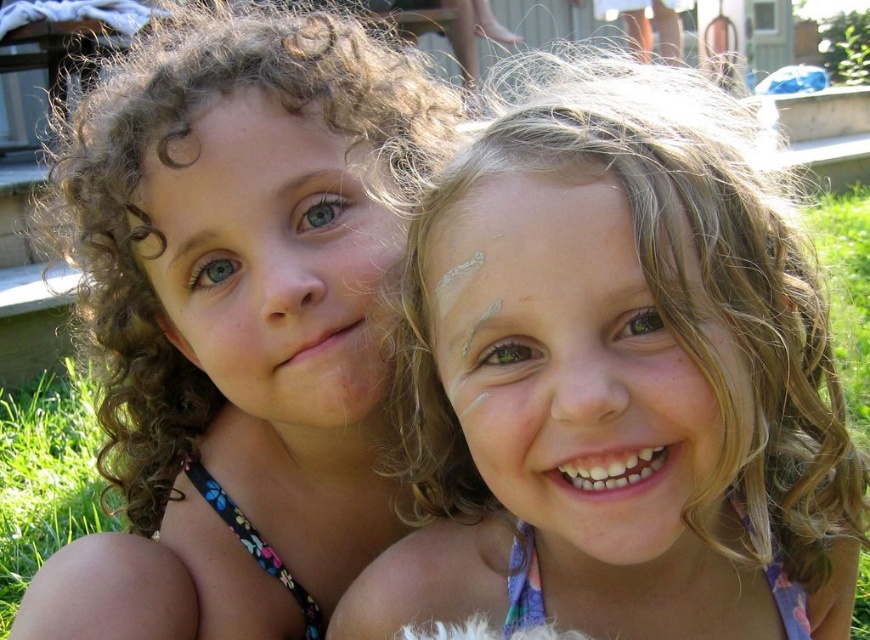
The height and width of the screenshot is (640, 870). I want to click on blonde curly hair at upper right, so click(x=618, y=380).

The width and height of the screenshot is (870, 640). Find the location of `blonde curly hair at upper right`. blonde curly hair at upper right is located at coordinates (618, 380).

Is curly hair at left shorter than green grass at lower left?

No, curly hair at left is not shorter than green grass at lower left.

Is curly hair at left further to the viewer compared to green grass at lower left?

No, curly hair at left is closer to the viewer.

Where is `curly hair at left`? The image size is (870, 640). curly hair at left is located at coordinates (236, 321).

Can you confirm if blonde curly hair at upper right is taller than green grass at lower left?

Indeed, blonde curly hair at upper right has a greater height compared to green grass at lower left.

Describe the element at coordinates (618, 380) in the screenshot. This screenshot has width=870, height=640. I see `blonde curly hair at upper right` at that location.

You are a GUI agent. You are given a task and a screenshot of the screen. Output one action in this format:
    pyautogui.click(x=<x>, y=<y>)
    Task: Click on the blonde curly hair at upper right
    Image resolution: width=870 pixels, height=640 pixels.
    Given the screenshot: What is the action you would take?
    pyautogui.click(x=618, y=380)